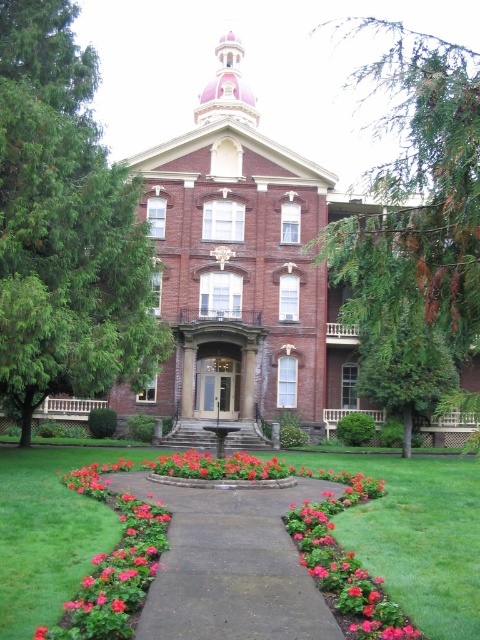
You are standing on the lawn in front of the building and want to approach the entrance. You see the green leafy tree at left and the concrete pathway at center. Which object is closer to you as you face the building?

The green leafy tree at left is closer to you because the concrete pathway at center is behind it.

You are standing at the entrance of the building and want to walk to the green leafy tree at left. Which direction should you turn to reach it from the concrete pathway at center?

The green leafy tree at left is to the left of the concrete pathway at center, so you should turn left from the concrete pathway at center to reach it.

You are a gardener planning to mow the green grass at center and concrete pathway at center. Which one should you mow first according to their positions?

The green grass at center is positioned over the concrete pathway at center, so you should mow the green grass at center first as it is above the pathway.